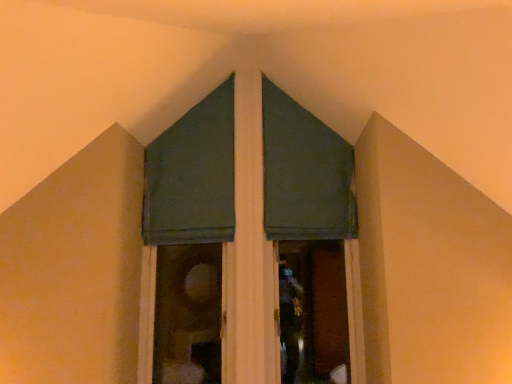
Question: Considering their positions, is green fabric curtain at center, placed as the second curtain when sorted from right to left, located in front of or behind green fabric curtain at upper center, the 3th curtain in the right-to-left sequence?

Choices:
 (A) behind
 (B) front

Answer: (B)

Question: From the image's perspective, is green fabric curtain at center, which ranks as the 2th curtain in left-to-right order, located above or below green fabric curtain at upper center, the 3th curtain in the right-to-left sequence?

Choices:
 (A) below
 (B) above

Answer: (A)

Question: Which object is the closest to the dark green fabric at upper center, the third curtain viewed from the left?

Choices:
 (A) green fabric curtain at upper center, marked as the 1th curtain in a left-to-right arrangement
 (B) green fabric curtain at center, placed as the second curtain when sorted from right to left

Answer: (A)

Question: Based on their relative distances, which object is farther from the dark green fabric at upper center, which is counted as the 1th curtain, starting from the right?

Choices:
 (A) green fabric curtain at upper center, marked as the 1th curtain in a left-to-right arrangement
 (B) green fabric curtain at center, placed as the second curtain when sorted from right to left

Answer: (B)